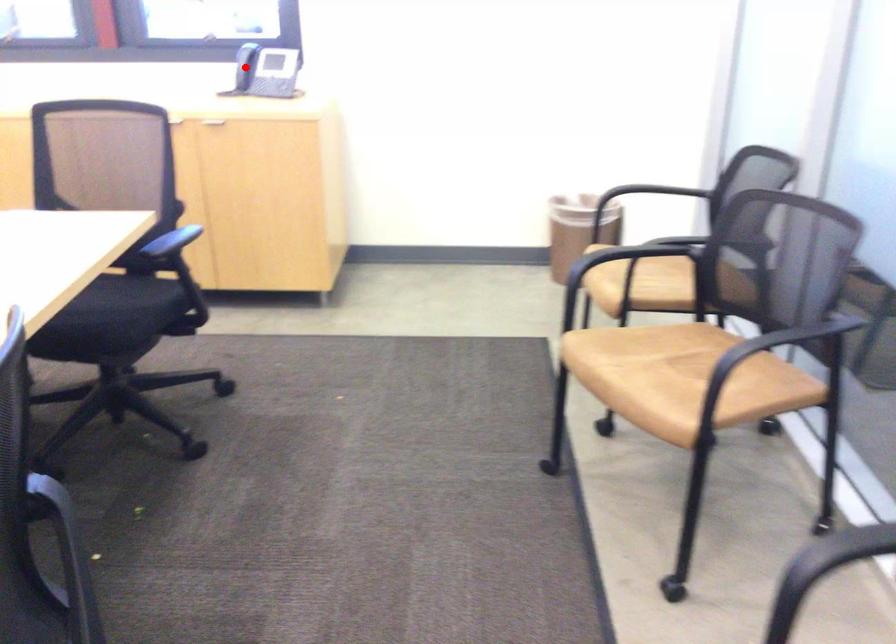
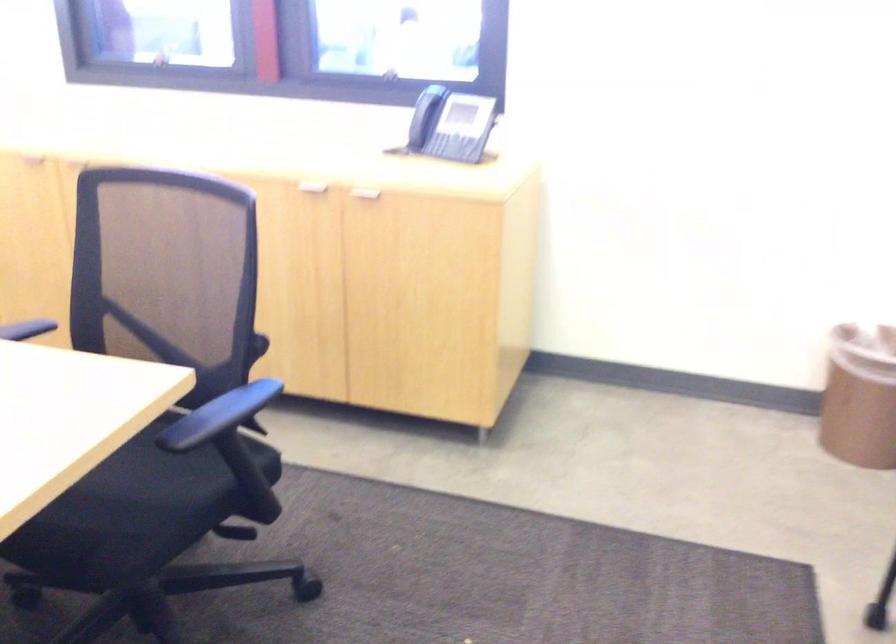
Question: A red point is marked in image1. In image2, is the corresponding 3D point closer to the camera or farther? Reply with the corresponding letter.

Choices:
 (A) The corresponding 3D point is closer.
 (B) The corresponding 3D point is farther.

Answer: (A)